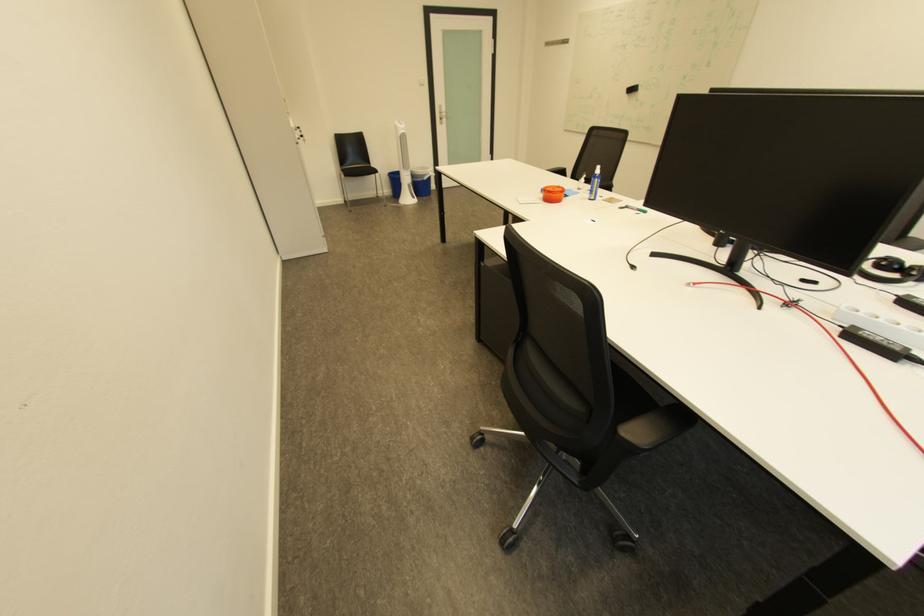
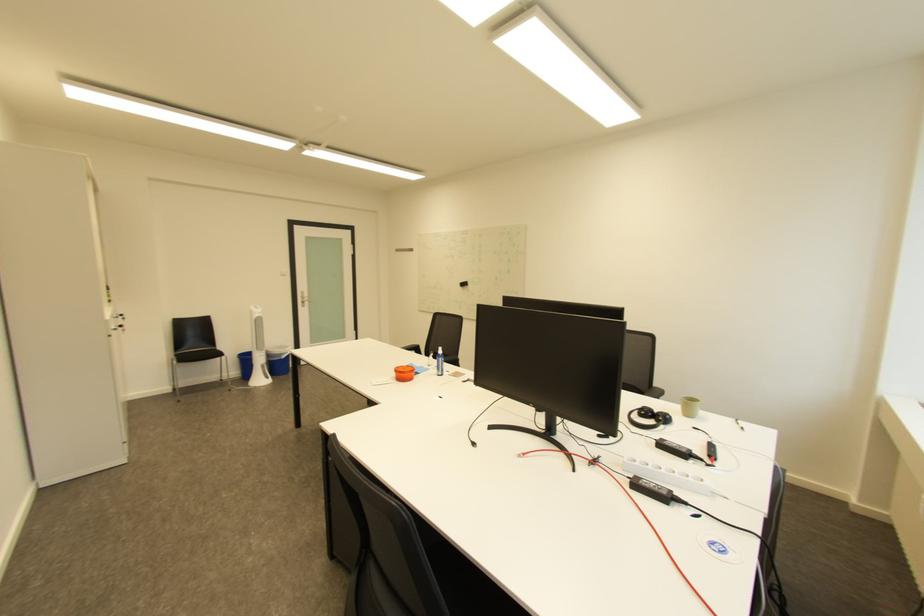
In the second image, find the point that corresponds to (351,171) in the first image.

(186, 357)